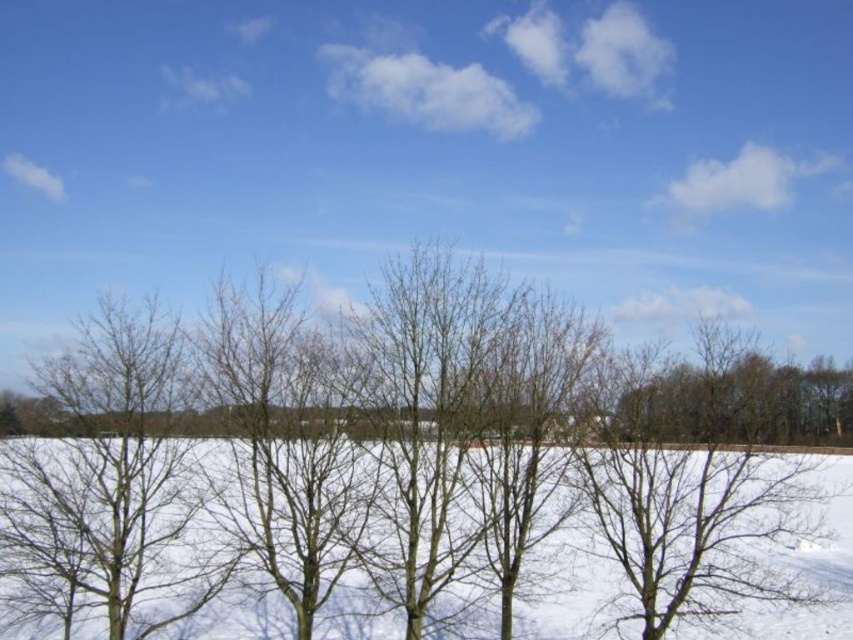
You are an artist planning to paint the winter landscape. You need to decide which area to focus on first based on their sizes. Which object should you paint first, the bare branches at left or the white powdery snow at center?

The bare branches at left is smaller than the white powdery snow at center, so you should paint the white powdery snow at center first as it covers a larger area and forms the main background for the smaller details like the branches.